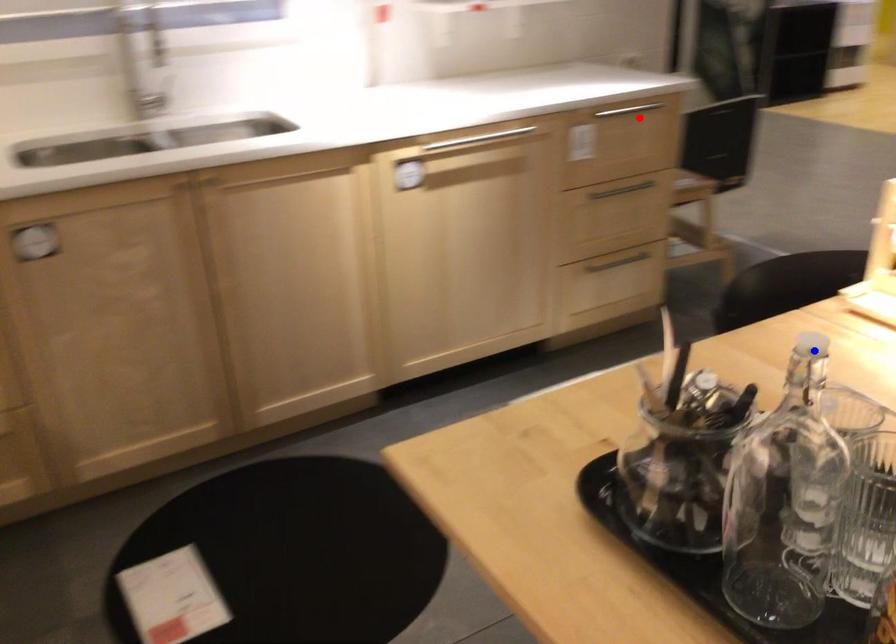
Question: Two points are marked on the image. Which point is closer to the camera?

Choices:
 (A) Blue point is closer.
 (B) Red point is closer.

Answer: (A)